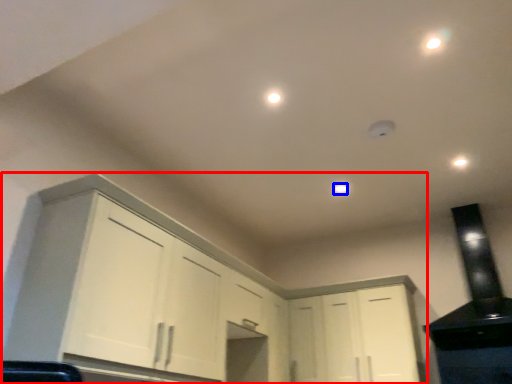
Question: Which object appears closest to the camera in this image, cabinetry (highlighted by a red box) or dot (highlighted by a blue box)?

Choices:
 (A) cabinetry
 (B) dot

Answer: (A)